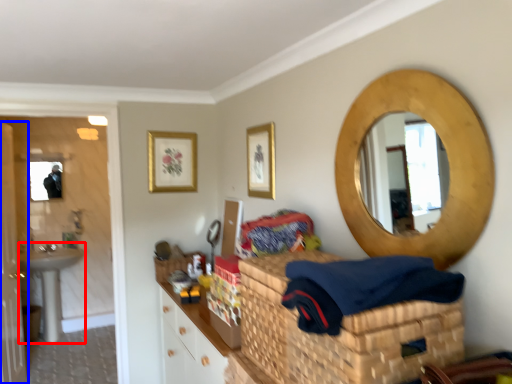
Question: Among these objects, which one is farthest to the camera, sink (highlighted by a red box) or door (highlighted by a blue box)?

Choices:
 (A) sink
 (B) door

Answer: (A)